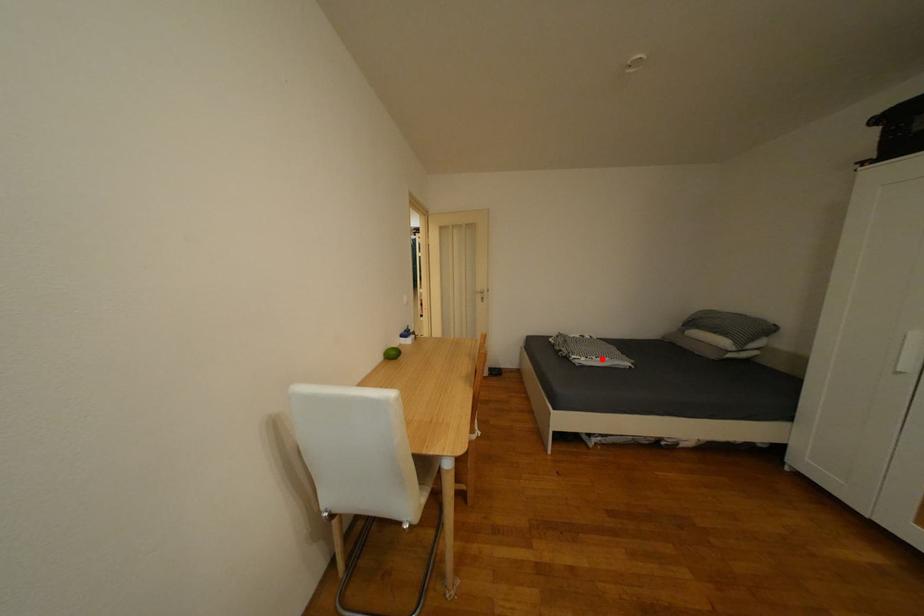
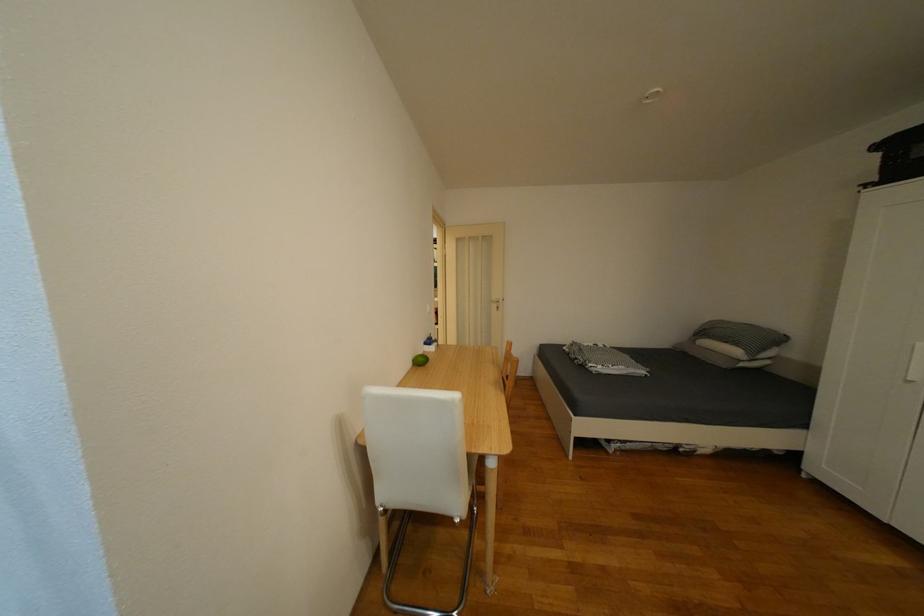
The point at the highlighted location is marked in the first image. Where is the corresponding point in the second image?

(618, 368)